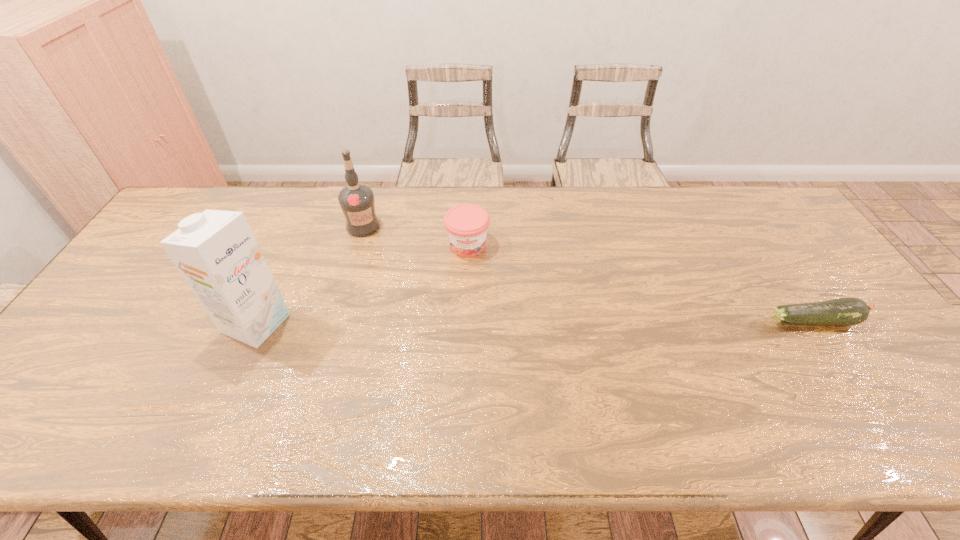
Find the location of a particular element. vacant space located on the front label of the third tallest object is located at coordinates (478, 342).

The image size is (960, 540). I want to click on free location located on the front label of the third tallest object, so click(479, 355).

Where is `vacant position located on the front label of the vodka`? vacant position located on the front label of the vodka is located at coordinates (393, 254).

Where is `vacant position located on the front label of the vodka`? vacant position located on the front label of the vodka is located at coordinates (446, 306).

Identify the location of free space located 0.080m on the front label of the vodka. (385, 247).

Identify the location of object located at the far edge. The image size is (960, 540). (356, 200).

Find the location of `object located at the right edge`. object located at the right edge is located at coordinates (848, 311).

The image size is (960, 540). I want to click on vacant space at the far edge, so click(x=563, y=202).

Identify the location of vacant area at the near edge of the desktop. point(414,379).

The width and height of the screenshot is (960, 540). In the image, there is a desktop. Find the location of `vacant space at the left edge`. vacant space at the left edge is located at coordinates (102, 313).